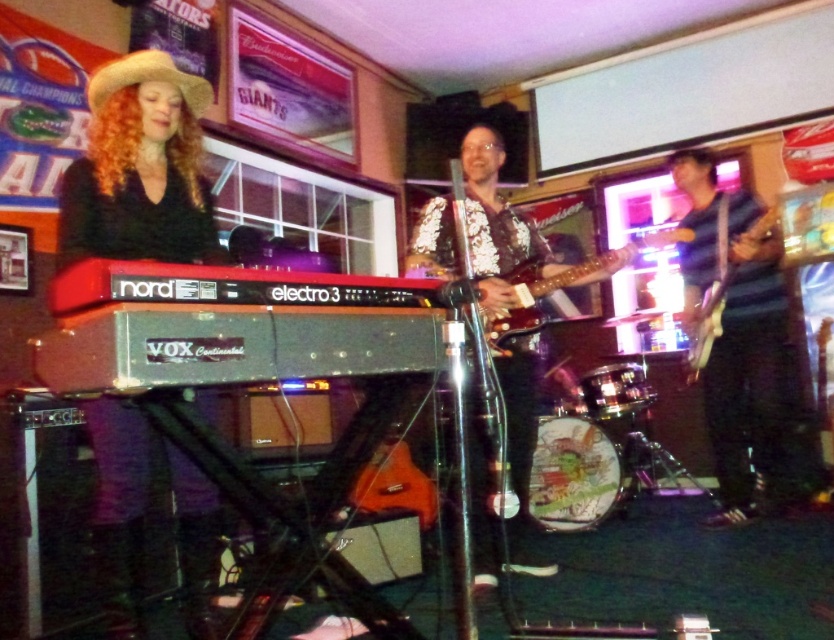
What do you see at coordinates (493, 221) in the screenshot? I see `shiny sequined shirt at center` at bounding box center [493, 221].

Can you confirm if shiny sequined shirt at center is positioned to the left of shiny black electric guitar at right?

Correct, you'll find shiny sequined shirt at center to the left of shiny black electric guitar at right.

Measure the distance between shiny sequined shirt at center and camera.

2.49 meters

Locate an element on the screen. shiny sequined shirt at center is located at coordinates (493, 221).

Which is more to the right, matte black keyboard at center or shiny sequined shirt at center?

Positioned to the right is shiny sequined shirt at center.

Is matte black keyboard at center below shiny sequined shirt at center?

Yes, matte black keyboard at center is below shiny sequined shirt at center.

Identify the location of matte black keyboard at center. The width and height of the screenshot is (834, 640). (139, 168).

Can you confirm if shiny silver guitar at right is wider than glossy wood guitar at center?

No.

Does shiny silver guitar at right appear over glossy wood guitar at center?

Incorrect, shiny silver guitar at right is not positioned above glossy wood guitar at center.

This screenshot has width=834, height=640. What do you see at coordinates (741, 342) in the screenshot? I see `shiny silver guitar at right` at bounding box center [741, 342].

At what (x,y) coordinates should I click in order to perform the action: click on shiny silver guitar at right. Please return your answer as a coordinate pair (x, y). This screenshot has width=834, height=640. Looking at the image, I should click on (741, 342).